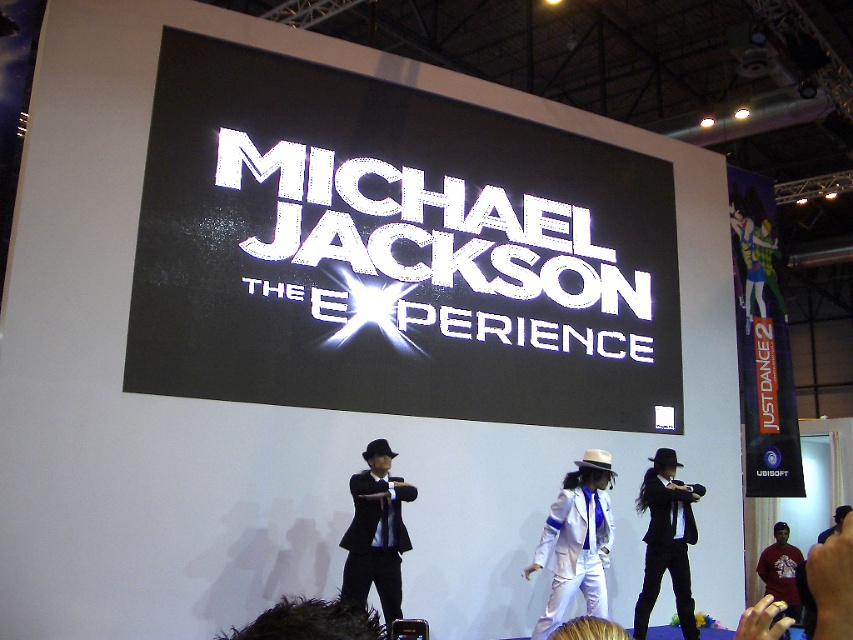
Can you confirm if black matte suit at center is positioned above shiny black suit at center?

Indeed, black matte suit at center is positioned over shiny black suit at center.

Who is more distant from viewer, (363,518) or (676,506)?

Positioned behind is point (676,506).

Measure the distance between black matte suit at center and camera.

black matte suit at center and camera are 6.54 meters apart.

Find the location of a particular element. Image resolution: width=853 pixels, height=640 pixels. black matte suit at center is located at coordinates (376, 532).

Is white satin hat at center closer to the viewer compared to black matte suit at center?

No, white satin hat at center is further to the viewer.

Does white satin hat at center have a smaller size compared to black matte suit at center?

Indeed, white satin hat at center has a smaller size compared to black matte suit at center.

What do you see at coordinates (576, 541) in the screenshot? Image resolution: width=853 pixels, height=640 pixels. I see `white satin hat at center` at bounding box center [576, 541].

In order to click on white satin hat at center in this screenshot , I will do `click(576, 541)`.

How far apart are shiny black suit at center and red cotton shirt at lower right?

shiny black suit at center is 2.74 meters away from red cotton shirt at lower right.

Is shiny black suit at center further to camera compared to red cotton shirt at lower right?

No, it is in front of red cotton shirt at lower right.

Where is `shiny black suit at center`? shiny black suit at center is located at coordinates (666, 540).